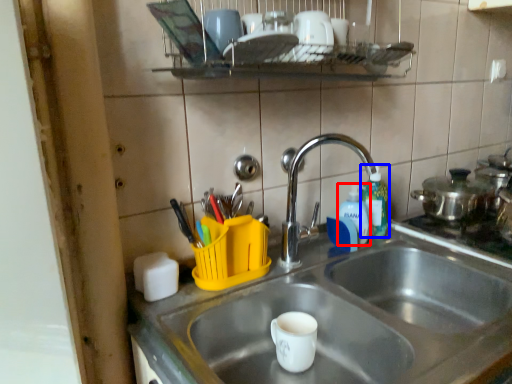
Question: Among these objects, which one is nearest to the camera, bottle (highlighted by a red box) or bottle (highlighted by a blue box)?

Choices:
 (A) bottle
 (B) bottle

Answer: (A)